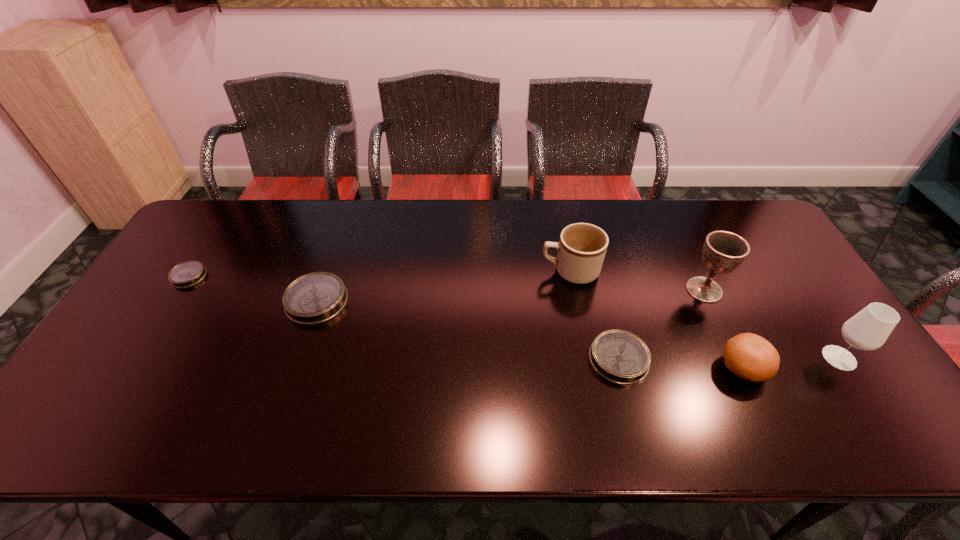
The width and height of the screenshot is (960, 540). What are the coordinates of `vacant space located 0.190m on the right of the sixth object from right to left` in the screenshot? It's located at (415, 301).

You are a GUI agent. You are given a task and a screenshot of the screen. Output one action in this format:
    pyautogui.click(x=<x>, y=<y>)
    Task: Click on the vacant space located on the left of the sixth tallest object
    The height and width of the screenshot is (540, 960).
    Given the screenshot: What is the action you would take?
    pyautogui.click(x=515, y=359)

Locate an element on the screen. This screenshot has height=540, width=960. vacant space positioned 0.330m on the back of the chalice is located at coordinates (665, 209).

The image size is (960, 540). I want to click on free space located 0.340m on the left of the rightmost object, so click(689, 358).

The image size is (960, 540). Find the location of `free space located on the side of the mug with the handle`. free space located on the side of the mug with the handle is located at coordinates (421, 271).

Identify the location of vacant space located 0.140m on the side of the mug with the handle. The width and height of the screenshot is (960, 540). (494, 271).

At what (x,y) coordinates should I click in order to perform the action: click on free location located 0.200m on the side of the mug with the handle. Please return your answer as a coordinate pair (x, y). Image resolution: width=960 pixels, height=540 pixels. Looking at the image, I should click on (474, 271).

Find the location of `free location located on the right of the clementine`. free location located on the right of the clementine is located at coordinates (803, 368).

Find the location of a particular element. The height and width of the screenshot is (540, 960). compass that is at the near edge is located at coordinates point(619,356).

The height and width of the screenshot is (540, 960). What are the coordinates of `glass situated at the near edge` in the screenshot? It's located at (869, 329).